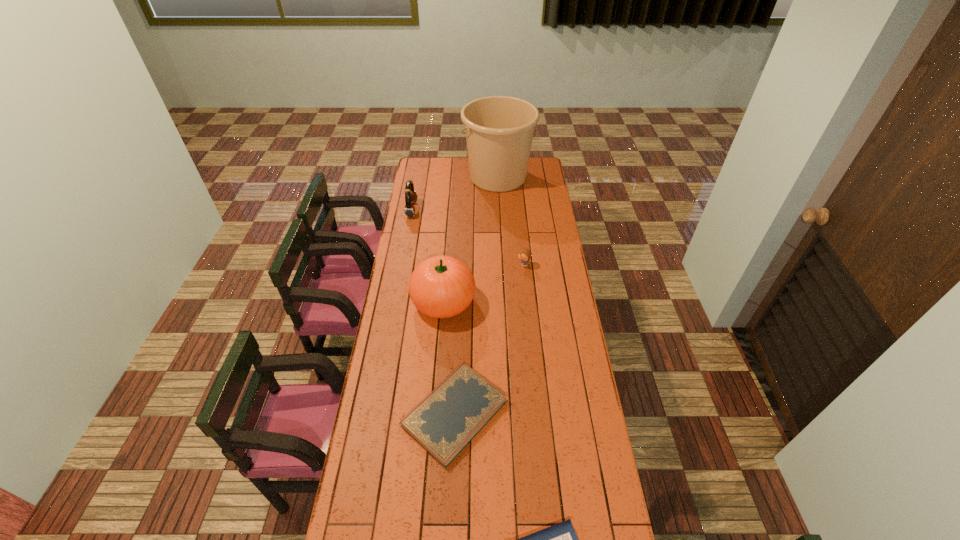
The width and height of the screenshot is (960, 540). I want to click on free space that is in between the fifth tallest object and the fourth tallest object, so click(x=490, y=339).

The height and width of the screenshot is (540, 960). In order to click on blank region between the fourth farthest object and the headset in this screenshot , I will do `click(427, 255)`.

Find the location of `free space between the farthest object and the duck`. free space between the farthest object and the duck is located at coordinates (511, 221).

Locate an element on the screen. vacant area that lies between the fourth farthest object and the fourth nearest object is located at coordinates (483, 283).

Point out which object is positioned as the nearest to the fourth farthest object. Please provide its 2D coordinates. Your answer should be formatted as a tuple, i.e. [(x, y)], where the tuple contains the x and y coordinates of a point satisfying the conditions above.

[(443, 423)]

Identify which object is the fourth closest to the bucket. Please provide its 2D coordinates. Your answer should be formatted as a tuple, i.e. [(x, y)], where the tuple contains the x and y coordinates of a point satisfying the conditions above.

[(443, 423)]

At what (x,y) coordinates should I click in order to perform the action: click on free region that satisfies the following two spatial constraints: 1. on the back side of the second tallest object; 2. on the ear cup of the third tallest object. Please return your answer as a coordinate pair (x, y). The image size is (960, 540). Looking at the image, I should click on (450, 210).

Locate an element on the screen. vacant space that satisfies the following two spatial constraints: 1. on the back side of the pumpkin; 2. on the ear cup of the second farthest object is located at coordinates (450, 210).

Image resolution: width=960 pixels, height=540 pixels. In order to click on vacant space that satisfies the following two spatial constraints: 1. on the front-facing side of the third farthest object; 2. on the front side of the pumpkin in this screenshot , I will do (x=527, y=301).